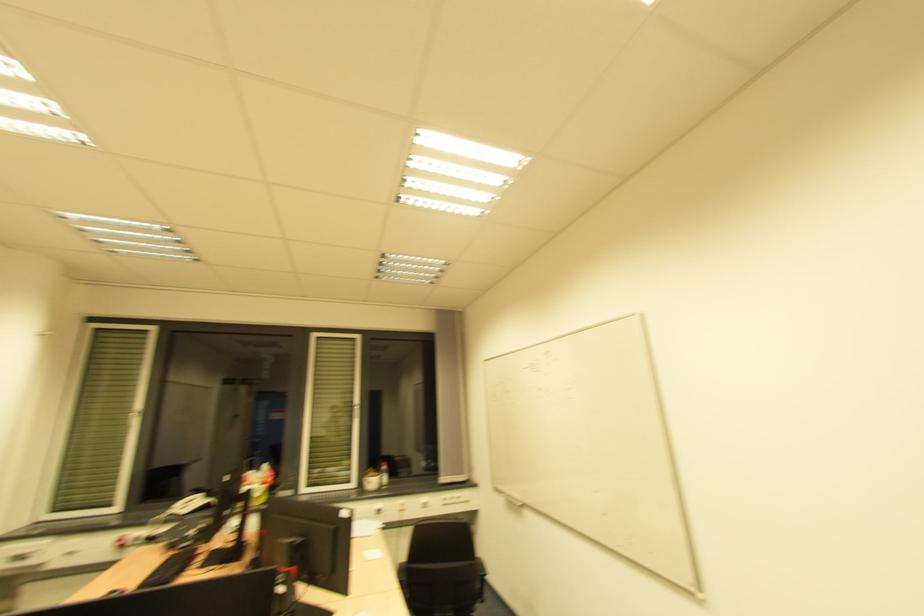
Where would you turn the white window handle? Please return your answer as a coordinate pair (x, y).

(331, 413)